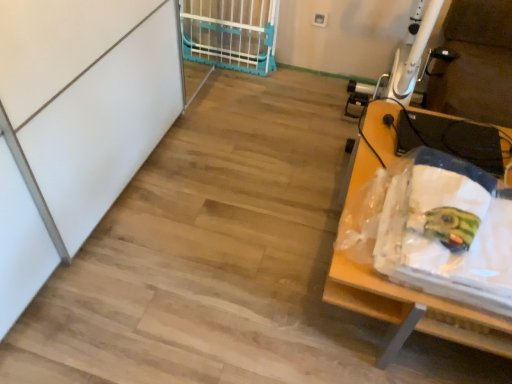
Locate an element on the screen. The height and width of the screenshot is (384, 512). free space that is in between wooden table at right and blue plastic gate at upper center is located at coordinates (273, 146).